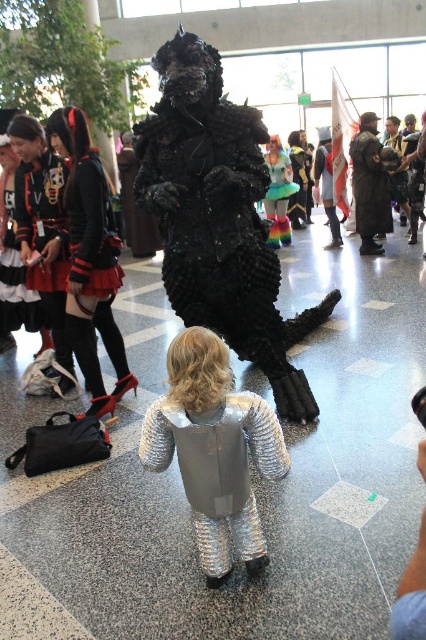
Between velvet black dress at left and shiny silver armor at center, which one has less height?

With less height is shiny silver armor at center.

Is the position of velvet black dress at left more distant than that of shiny silver armor at center?

Yes, velvet black dress at left is behind shiny silver armor at center.

Where is `velvet black dress at left`? The image size is (426, 640). velvet black dress at left is located at coordinates (89, 259).

Between shiny silver armor at center and matte black dress at left, which one is positioned higher?

matte black dress at left is above.

Is shiny silver armor at center to the left of matte black dress at left from the viewer's perspective?

Incorrect, shiny silver armor at center is not on the left side of matte black dress at left.

Is point (241, 401) behind point (43, 280)?

No, it is not.

Locate an element on the screen. Image resolution: width=426 pixels, height=640 pixels. shiny silver armor at center is located at coordinates [252, 432].

How much distance is there between velvet black dress at left and matte black dress at left?

A distance of 12.44 inches exists between velvet black dress at left and matte black dress at left.

I want to click on velvet black dress at left, so click(89, 259).

Locate an element on the screen. velvet black dress at left is located at coordinates (89, 259).